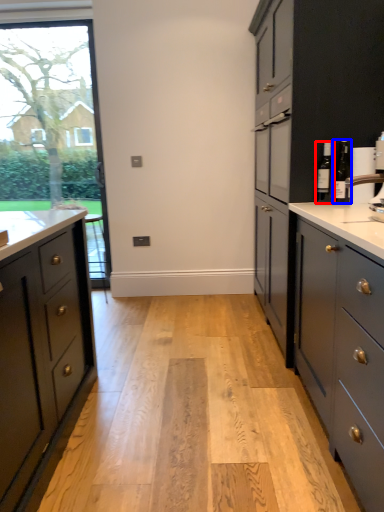
Question: Among these objects, which one is nearest to the camera, bottle (highlighted by a red box) or bottle (highlighted by a blue box)?

Choices:
 (A) bottle
 (B) bottle

Answer: (B)